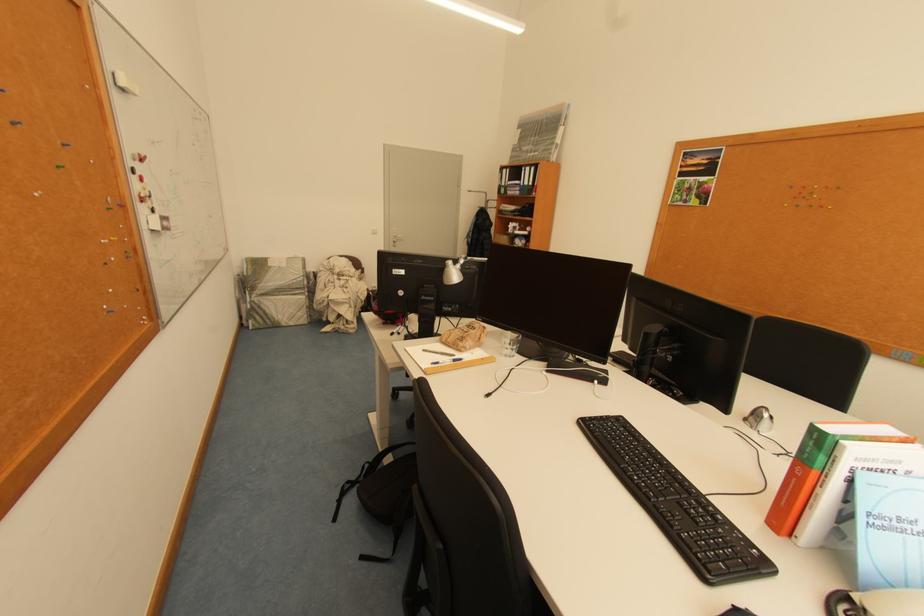
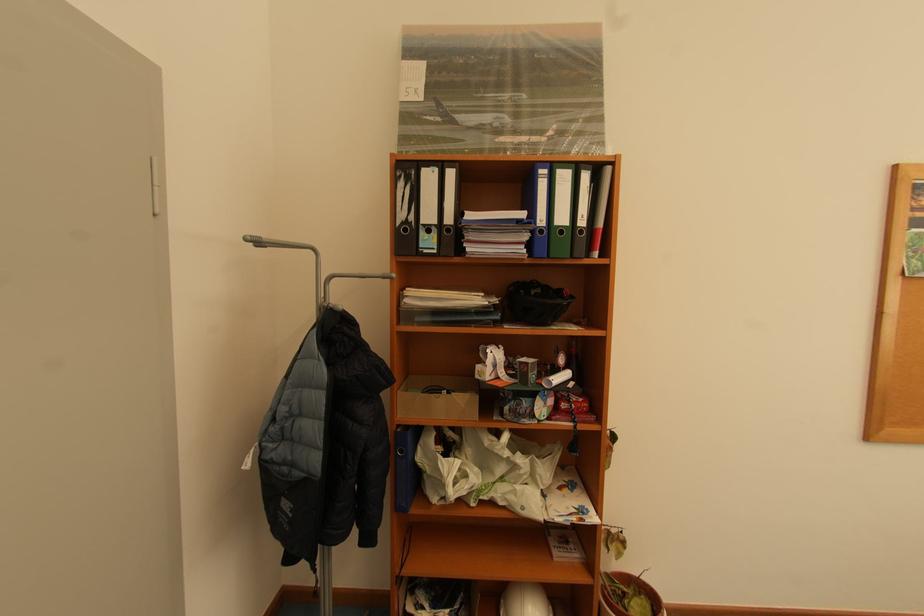
Where in the second image is the point corresponding to (x=531, y=169) from the first image?

(552, 172)